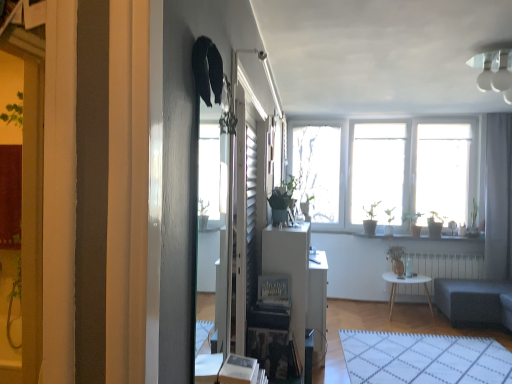
Question: Does green matte plant at center, the first houseplant in the right-to-left sequence, appear on the left side of green matte plant at center, which ranks as the 2th houseplant in right-to-left order?

Choices:
 (A) no
 (B) yes

Answer: (A)

Question: From the image's perspective, does green matte plant at center, which is the second houseplant in front-to-back order, appear lower than green matte plant at center, arranged as the second houseplant when viewed from the back?

Choices:
 (A) yes
 (B) no

Answer: (A)

Question: From a real-world perspective, is green matte plant at center, which is the second houseplant in front-to-back order, on top of green matte plant at center, the 1th houseplant positioned from the left?

Choices:
 (A) no
 (B) yes

Answer: (A)

Question: Is green matte plant at center, the first houseplant in the right-to-left sequence, positioned in front of green matte plant at center, which ranks as the first houseplant in front-to-back order?

Choices:
 (A) no
 (B) yes

Answer: (A)

Question: Does green matte plant at center, which is the second houseplant in front-to-back order, have a larger size compared to green matte plant at center, which ranks as the first houseplant in front-to-back order?

Choices:
 (A) no
 (B) yes

Answer: (B)

Question: Is green matte plant at center, the 1th houseplant in the back-to-front sequence, placed right next to green matte plant at center, arranged as the second houseplant when viewed from the back?

Choices:
 (A) no
 (B) yes

Answer: (A)

Question: From the image's perspective, would you say white grid rug at lower center is positioned over white radiator at center?

Choices:
 (A) no
 (B) yes

Answer: (A)

Question: Considering the relative positions of white grid rug at lower center and white radiator at center in the image provided, is white grid rug at lower center in front of white radiator at center?

Choices:
 (A) no
 (B) yes

Answer: (B)

Question: Is white grid rug at lower center not close to white radiator at center?

Choices:
 (A) no
 (B) yes

Answer: (B)

Question: Considering the relative sizes of white grid rug at lower center and white radiator at center in the image provided, is white grid rug at lower center bigger than white radiator at center?

Choices:
 (A) yes
 (B) no

Answer: (A)

Question: Is white radiator at center completely or partially inside white grid rug at lower center?

Choices:
 (A) yes
 (B) no

Answer: (B)

Question: Does white grid rug at lower center have a lesser width compared to white radiator at center?

Choices:
 (A) no
 (B) yes

Answer: (A)

Question: Are white wooden table at center and white glossy table at center making contact?

Choices:
 (A) no
 (B) yes

Answer: (A)